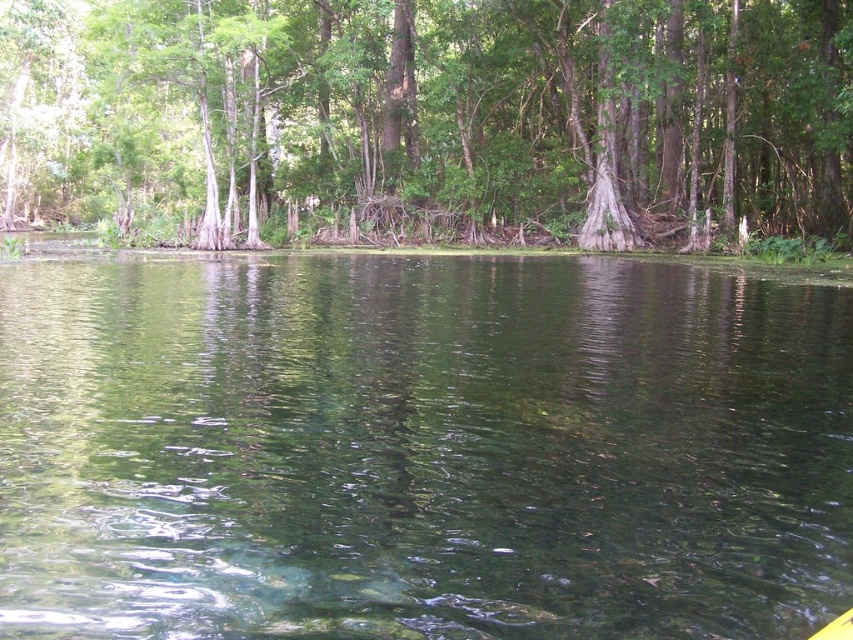
You are standing on a wooden dock and see the clear water at center and the green leafy tree at upper center. Which object is positioned to the right of the other?

The clear water at center is to the right of the green leafy tree at upper center.

You are standing in the swamp and see two points in the water. The first point is at coordinate point (x=474, y=620) and the second is at point (x=248, y=141). Which point is closer to you?

Point (x=474, y=620) is closer to the camera than point (x=248, y=141), so the first point is closer to you.

You are a kayaker in the swamp and want to know if your kayak can fit between the clear water at center and the green leafy tree at upper center. The kayak is 1.2 meters wide. Can it fit?

The clear water at center has a lesser width compared to green leafy tree at upper center. Since the kayak is 1.2 meters wide and the clear water at center is narrower than the tree, it might not have enough space. Check the width of the clear water specifically before deciding.